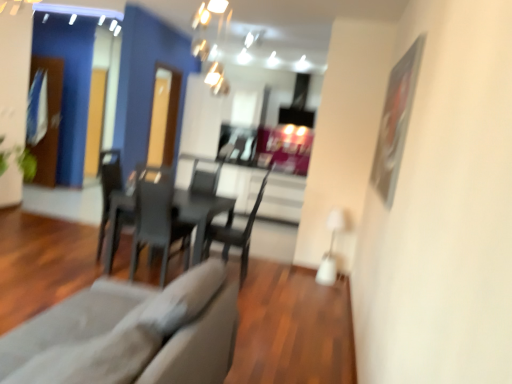
Question: Should I look upward or downward to see gray fabric couch at lower left?

Choices:
 (A) down
 (B) up

Answer: (A)

Question: Is gray fabric couch at lower left taller than matte black chair at center, arranged as the 1th chair when viewed from the right?

Choices:
 (A) yes
 (B) no

Answer: (B)

Question: Does gray fabric couch at lower left have a greater width compared to matte black chair at center, arranged as the 2th chair when viewed from the left?

Choices:
 (A) yes
 (B) no

Answer: (A)

Question: Is the depth of gray fabric couch at lower left greater than that of matte black chair at center, arranged as the 2th chair when viewed from the left?

Choices:
 (A) yes
 (B) no

Answer: (B)

Question: Is gray fabric couch at lower left with matte black chair at center, arranged as the 2th chair when viewed from the left?

Choices:
 (A) no
 (B) yes

Answer: (A)

Question: From a real-world perspective, does gray fabric couch at lower left sit lower than matte black chair at center, arranged as the 2th chair when viewed from the left?

Choices:
 (A) no
 (B) yes

Answer: (B)

Question: Is gray fabric couch at lower left thinner than matte black chair at center, arranged as the 1th chair when viewed from the right?

Choices:
 (A) yes
 (B) no

Answer: (B)

Question: Does transparent glass door at left, which ranks as the second glass door in right-to-left order, come behind matte black chair at center, arranged as the 1th chair when viewed from the right?

Choices:
 (A) no
 (B) yes

Answer: (B)

Question: From a real-world perspective, is transparent glass door at left, the second glass door positioned from the front, positioned over matte black chair at center, arranged as the 2th chair when viewed from the left, based on gravity?

Choices:
 (A) no
 (B) yes

Answer: (B)

Question: Can you confirm if transparent glass door at left, the 1th glass door when ordered from back to front, is wider than matte black chair at center, arranged as the 1th chair when viewed from the right?

Choices:
 (A) yes
 (B) no

Answer: (B)

Question: Does transparent glass door at left, the second glass door positioned from the front, have a lesser width compared to matte black chair at center, arranged as the 2th chair when viewed from the left?

Choices:
 (A) no
 (B) yes

Answer: (B)

Question: Is transparent glass door at left, which ranks as the second glass door in right-to-left order, smaller than matte black chair at center, arranged as the 1th chair when viewed from the right?

Choices:
 (A) yes
 (B) no

Answer: (A)

Question: Does transparent glass door at left, which is the first glass door from left to right, turn towards matte black chair at center, arranged as the 1th chair when viewed from the right?

Choices:
 (A) yes
 (B) no

Answer: (B)

Question: From the image's perspective, would you say transparent glass door at left, which ranks as the second glass door in right-to-left order, is shown under transparent glass door at center, marked as the first glass door in a right-to-left arrangement?

Choices:
 (A) no
 (B) yes

Answer: (A)